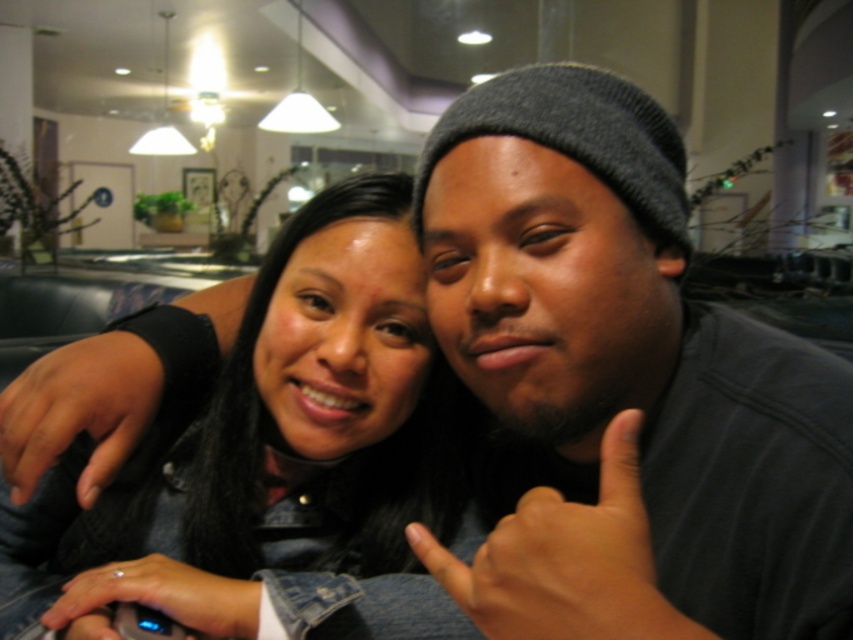
You are a photographer trying to capture a candid shot of the dark skin tone hand at center and the dark blue denim jacket at lower left. Since you want to ensure both subjects are in focus, you need to know their relative heights. Which object is taller?

The dark skin tone hand at center has a lesser height compared to dark blue denim jacket at lower left, so the dark blue denim jacket at lower left is taller.